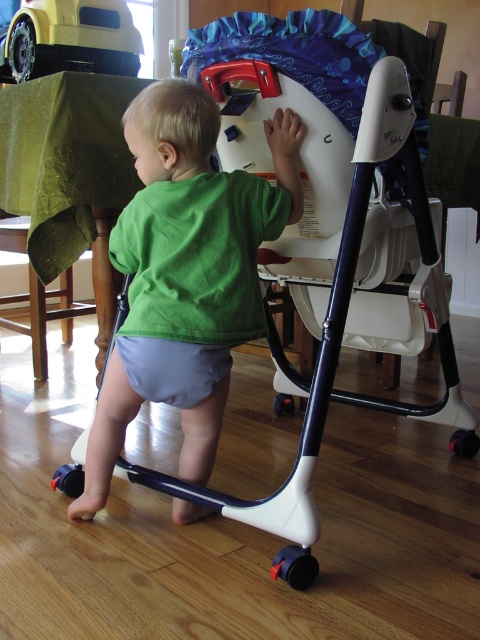
Describe the element at coordinates (200, 240) in the screenshot. This screenshot has width=480, height=640. I see `green fabric shirt at center` at that location.

Which is above, green fabric shirt at center or yellow matte toy car at upper left?

yellow matte toy car at upper left is above.

Does point (151, 212) come behind point (80, 65)?

No, (151, 212) is in front of (80, 65).

At what (x,y) coordinates should I click in order to perform the action: click on green fabric shirt at center. Please return your answer as a coordinate pair (x, y). Image resolution: width=480 pixels, height=640 pixels. Looking at the image, I should click on (200, 240).